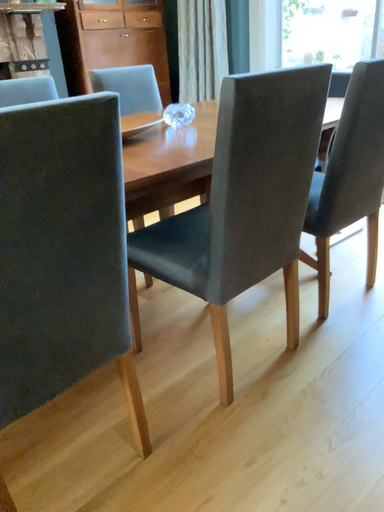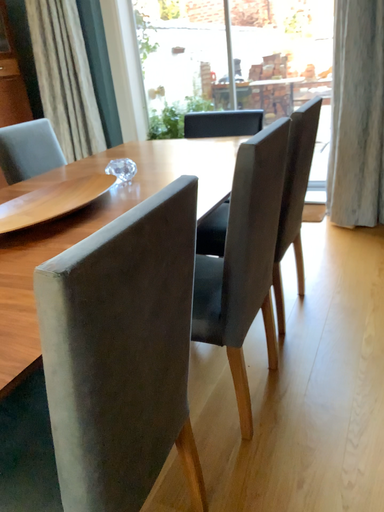
Question: How did the camera likely rotate when shooting the video?

Choices:
 (A) rotated left
 (B) rotated right

Answer: (B)